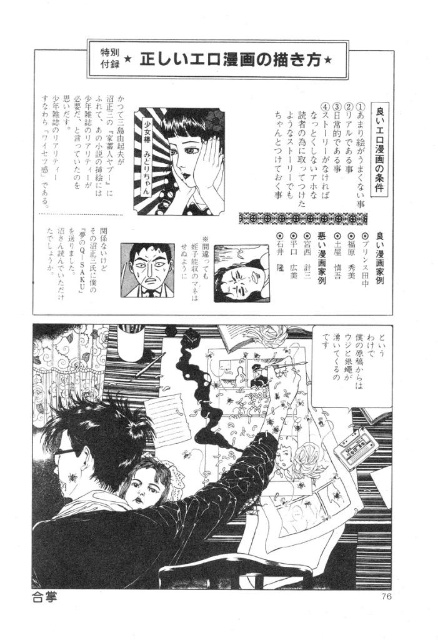
Which is below, black glossy hair at center or smooth black hair at center?

Positioned lower is black glossy hair at center.

Is point (225, 508) behind point (261, 276)?

No, (225, 508) is closer to viewer.

You are a GUI agent. You are given a task and a screenshot of the screen. Output one action in this format:
    pyautogui.click(x=<x>, y=<y>)
    Task: Click on the black glossy hair at center
    The width and height of the screenshot is (438, 640).
    Given the screenshot: What is the action you would take?
    click(x=127, y=502)

Is smooth black hair at upper center to the left of smooth black hair at center from the viewer's perspective?

Indeed, smooth black hair at upper center is positioned on the left side of smooth black hair at center.

The image size is (438, 640). Describe the element at coordinates (187, 163) in the screenshot. I see `smooth black hair at upper center` at that location.

Which is in front, point (219, 168) or point (221, 280)?

Point (221, 280) is in front.

The height and width of the screenshot is (640, 438). In order to click on smooth black hair at upper center in this screenshot , I will do `click(187, 163)`.

Is black glossy hair at center smaller than matte black face at center?

Actually, black glossy hair at center might be larger than matte black face at center.

Describe the element at coordinates (127, 502) in the screenshot. This screenshot has height=640, width=438. I see `black glossy hair at center` at that location.

Where is `black glossy hair at center`? Image resolution: width=438 pixels, height=640 pixels. black glossy hair at center is located at coordinates (127, 502).